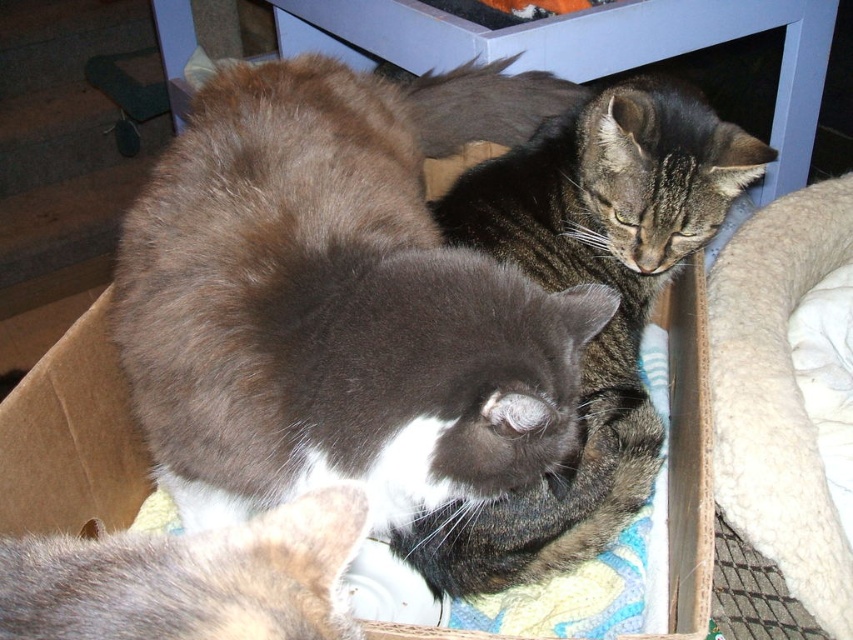
Question: Estimate the real-world distances between objects in this image. Which object is closer to the gray fur cat at center?

Choices:
 (A) tabby fur cat at center
 (B) white fluffy cat bed at right

Answer: (A)

Question: Where is gray fur cat at center located in relation to gray soft fur at lower left in the image?

Choices:
 (A) left
 (B) right

Answer: (B)

Question: Which is nearer to the gray fur cat at center?

Choices:
 (A) gray soft fur at lower left
 (B) tabby fur cat at center

Answer: (B)

Question: Does gray fur cat at center have a larger size compared to gray soft fur at lower left?

Choices:
 (A) yes
 (B) no

Answer: (A)

Question: Does gray fur cat at center come behind white fluffy cat bed at right?

Choices:
 (A) no
 (B) yes

Answer: (A)

Question: Which point is closer to the camera?

Choices:
 (A) (0, 573)
 (B) (755, 156)
 (C) (740, 496)

Answer: (A)